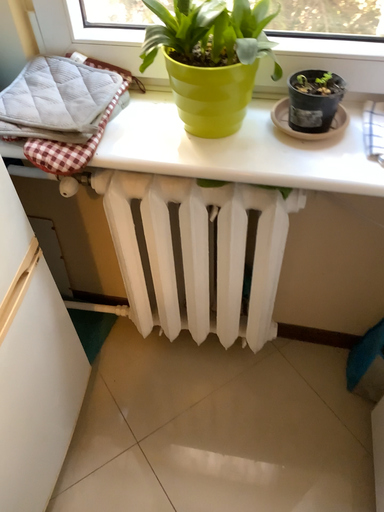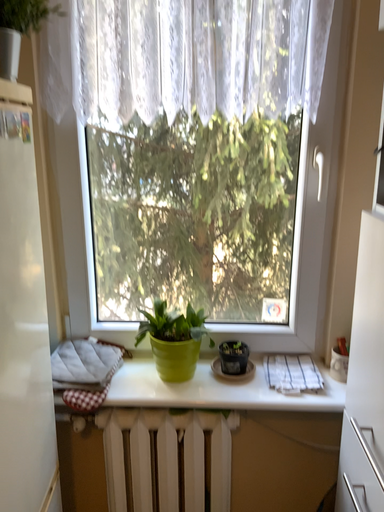
Question: Which way did the camera rotate in the video?

Choices:
 (A) rotated upward
 (B) rotated downward

Answer: (A)